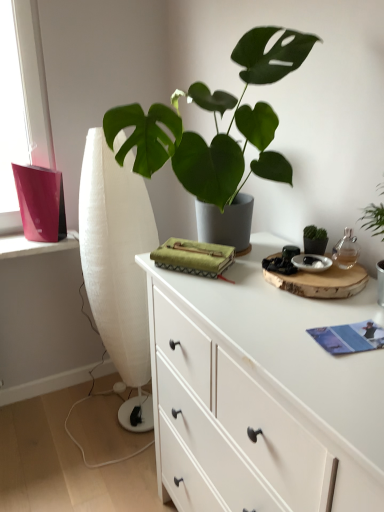
Question: Based on their positions, is white matte chest of drawers at center located to the left or right of white fabric curtain at left?

Choices:
 (A) right
 (B) left

Answer: (A)

Question: Considering their positions, is white matte chest of drawers at center located in front of or behind white fabric curtain at left?

Choices:
 (A) behind
 (B) front

Answer: (B)

Question: Which object is positioned farthest from the green matte plant at center?

Choices:
 (A) white fabric curtain at left
 (B) white matte chest of drawers at center
 (C) blue paper book at lower right

Answer: (A)

Question: Which object is positioned closest to the blue paper book at lower right?

Choices:
 (A) white matte chest of drawers at center
 (B) white fabric curtain at left
 (C) green matte plant at center

Answer: (A)